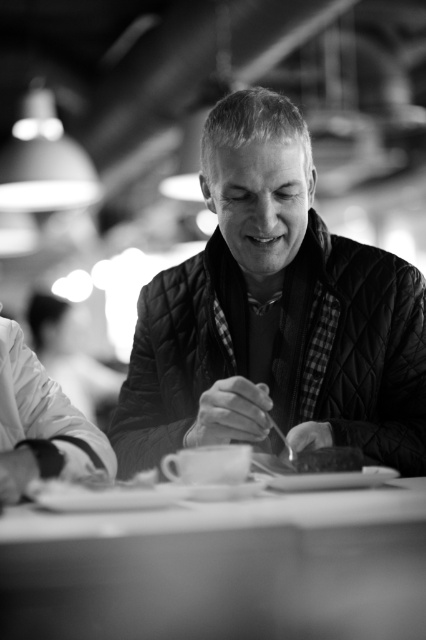
You are a delivery person who needs to place a small package on the table without touching the man or his belongings. The package is 12 inches wide. Can you fit it between the quilted fabric jacket at center and the smooth white table at center?

The distance between the quilted fabric jacket at center and the smooth white table at center is 16.77 inches. Since the package is 12 inches wide, it can fit in the space between them.

You are a waiter in a restaurant and need to place a new dessert menu on the table. The menu is the same size as the smooth chocolate bar at center. Will the smooth white table at center have enough space to accommodate the dessert menu without overlapping any existing items?

The smooth white table at center is larger in size than the smooth chocolate bar at center, so yes, the table has enough space to place the dessert menu as it is bigger than the chocolate bar.

You are a waiter in a restaurant and you see the smooth white table at center and the smooth chocolate bar at center. Which object is positioned to the left?

The smooth white table at center is to the left of the smooth chocolate bar at center, so the smooth white table at center is positioned to the left.